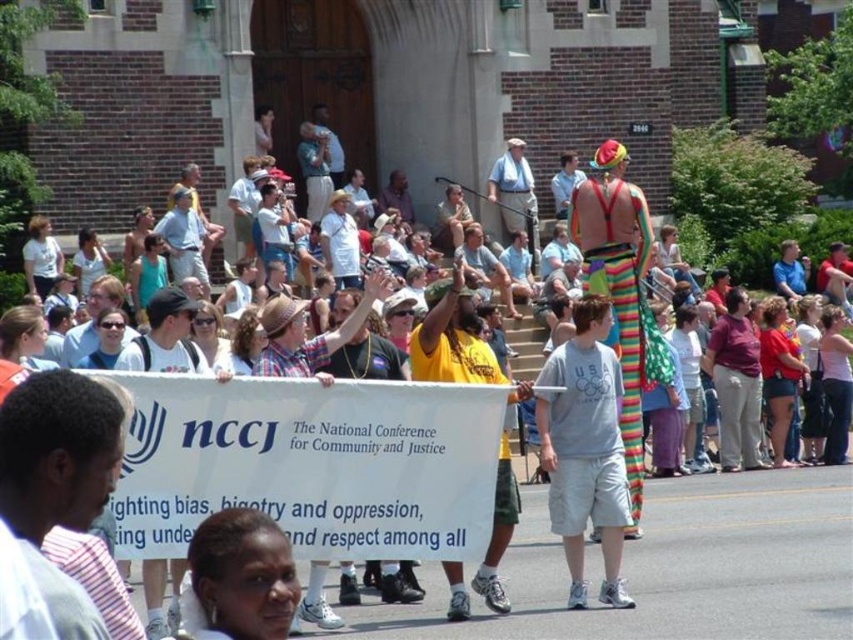
Is gray cotton t-shirt at center shorter than rainbow striped stilts at center?

Correct, gray cotton t-shirt at center is not as tall as rainbow striped stilts at center.

Who is positioned more to the left, gray cotton t-shirt at center or rainbow striped stilts at center?

A: gray cotton t-shirt at center

Measure the distance between gray cotton t-shirt at center and camera.

gray cotton t-shirt at center is 136.62 feet from camera.

The image size is (853, 640). What are the coordinates of `gray cotton t-shirt at center` in the screenshot? It's located at (585, 449).

Is rainbow striped stilts at center above yellow shirt at center?

Correct, rainbow striped stilts at center is located above yellow shirt at center.

Between rainbow striped stilts at center and yellow shirt at center, which one has more height?

rainbow striped stilts at center is taller.

What do you see at coordinates (621, 291) in the screenshot? The image size is (853, 640). I see `rainbow striped stilts at center` at bounding box center [621, 291].

Find the location of `rainbow striped stilts at center`. rainbow striped stilts at center is located at coordinates (621, 291).

Does gray cotton t-shirt at center have a larger size compared to yellow shirt at center?

Incorrect, gray cotton t-shirt at center is not larger than yellow shirt at center.

Who is more forward, (579, 515) or (508, 493)?

Point (508, 493) is in front.

Between point (584, 604) and point (502, 504), which one is positioned behind?

Positioned behind is point (502, 504).

This screenshot has width=853, height=640. What are the coordinates of `gray cotton t-shirt at center` in the screenshot? It's located at (585, 449).